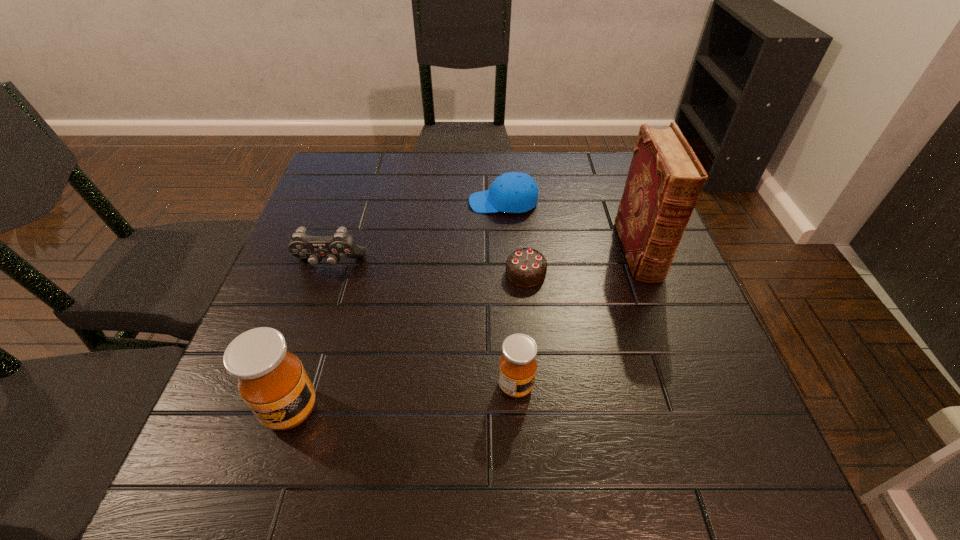
This screenshot has height=540, width=960. Find the location of `object present at the near left corner`. object present at the near left corner is located at coordinates (272, 381).

The height and width of the screenshot is (540, 960). Identify the location of free region at the far edge of the desktop. (397, 157).

Identify the location of free location at the near edge of the desktop. The width and height of the screenshot is (960, 540). click(x=507, y=397).

At what (x,y) coordinates should I click in order to perform the action: click on vacant space at the left edge of the desktop. Please return your answer as a coordinate pair (x, y). Looking at the image, I should click on (277, 315).

The image size is (960, 540). Find the location of `free space at the right edge`. free space at the right edge is located at coordinates (693, 298).

Find the location of `free space at the far left corner of the desktop`. free space at the far left corner of the desktop is located at coordinates (317, 192).

Locate an element on the screen. The width and height of the screenshot is (960, 540). vacant space at the near left corner of the desktop is located at coordinates [223, 398].

In order to click on free spot between the taller honey and the fifth tallest object in this screenshot , I will do `click(397, 306)`.

You are a GUI agent. You are given a task and a screenshot of the screen. Output one action in this format:
    pyautogui.click(x=<x>, y=<y>)
    Task: Click on the free space between the right honey and the hardback book
    This screenshot has height=540, width=960.
    Given the screenshot: What is the action you would take?
    pyautogui.click(x=577, y=319)

Image resolution: width=960 pixels, height=540 pixels. Identify the location of vacant area between the rightmost object and the right honey. (577, 319).